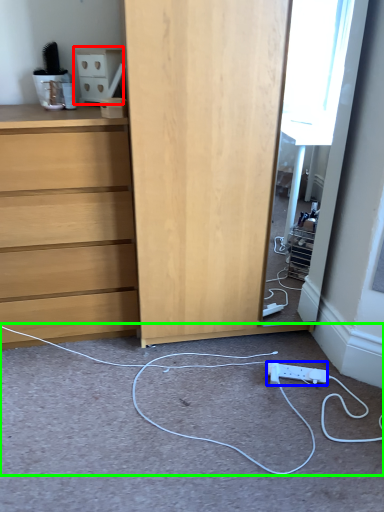
Question: Considering the real-world distances, which object is closest to cabinetry (highlighted by a red box)? electric outlet (highlighted by a blue box) or string (highlighted by a green box).

Choices:
 (A) electric outlet
 (B) string

Answer: (B)